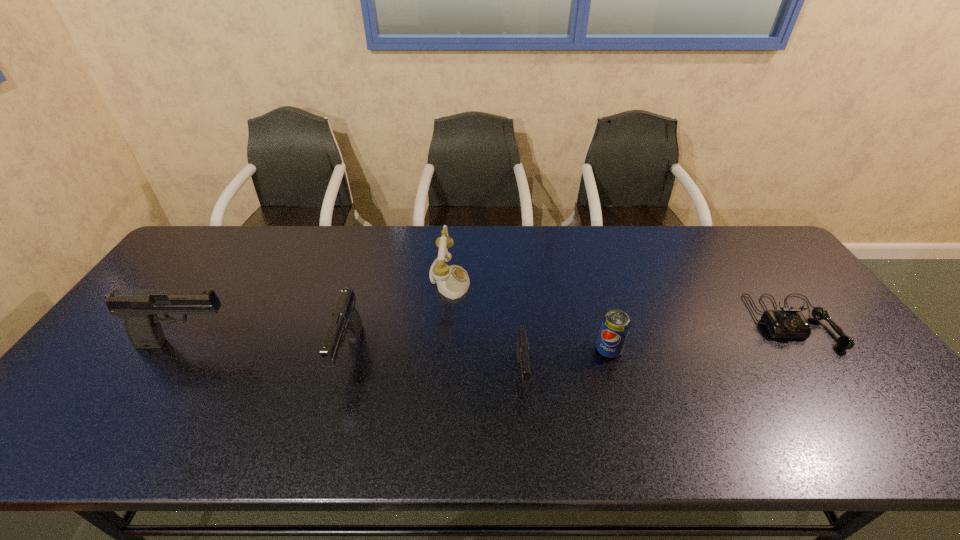
At what (x,y) coordinates should I click in order to perform the action: click on vacant space situated 0.100m aim along the barrel of the leftmost object. Please return your answer as a coordinate pair (x, y). Looking at the image, I should click on (276, 343).

Locate an element on the screen. free location located on the dial of the rightmost object is located at coordinates (839, 386).

Locate an element on the screen. This screenshot has width=960, height=540. free space located on the dial of the left telephone is located at coordinates (588, 281).

Identify the location of vacant area located on the back of the fifth object from left to right. The height and width of the screenshot is (540, 960). (582, 254).

Locate an element on the screen. The height and width of the screenshot is (540, 960). object that is at the far edge is located at coordinates (452, 281).

Where is `object at the left edge`? object at the left edge is located at coordinates (138, 307).

Where is `object located at the right edge`? The height and width of the screenshot is (540, 960). object located at the right edge is located at coordinates (789, 322).

In the image, there is a desktop. Identify the location of vacant space at the far edge. (396, 237).

You are a GUI agent. You are given a task and a screenshot of the screen. Output one action in this format:
    pyautogui.click(x=<x>, y=<y>)
    Task: Click on the free space at the near edge of the desktop
    
    Given the screenshot: What is the action you would take?
    pyautogui.click(x=195, y=385)

The image size is (960, 540). Find the location of `vacant region at the far right corner`. vacant region at the far right corner is located at coordinates (750, 260).